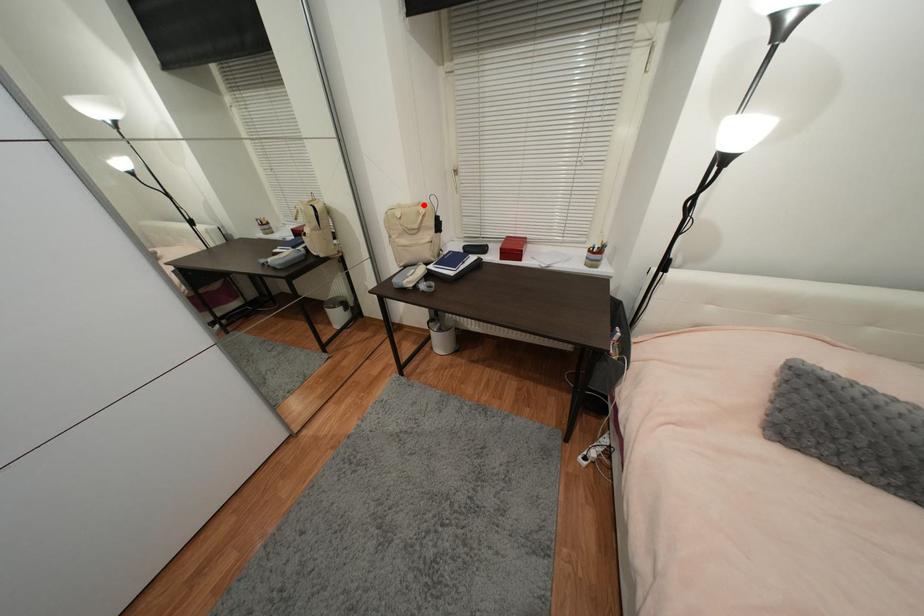
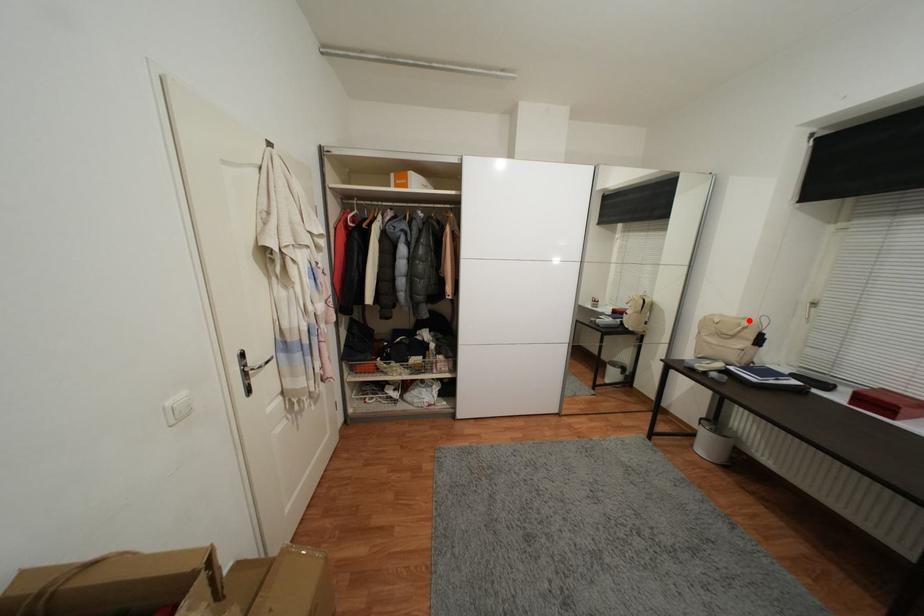
I am providing you with two images of the same scene from different viewpoints. A red point is marked on the first image and another point is marked on the second image. Do the highlighted points in image1 and image2 indicate the same real-world spot?

Yes